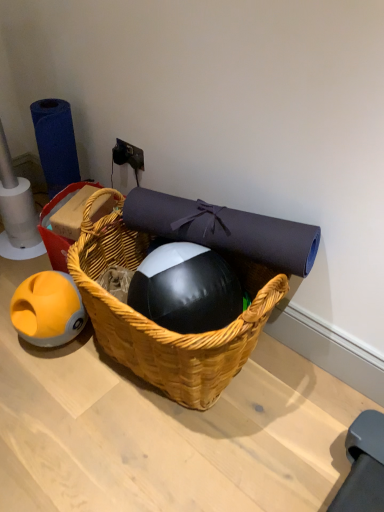
This screenshot has width=384, height=512. In order to click on vacant space in front of woven wood picnic basket at center in this screenshot , I will do `click(162, 456)`.